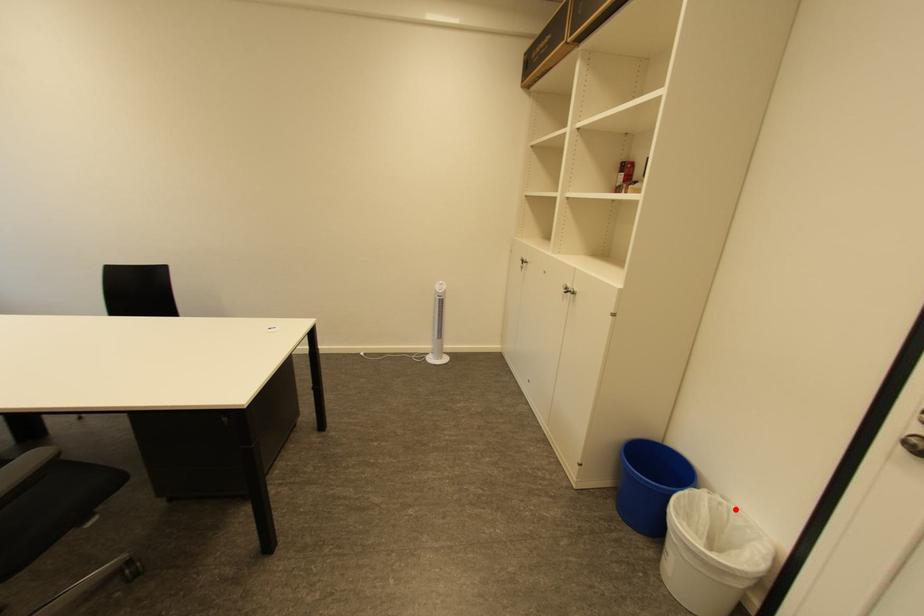
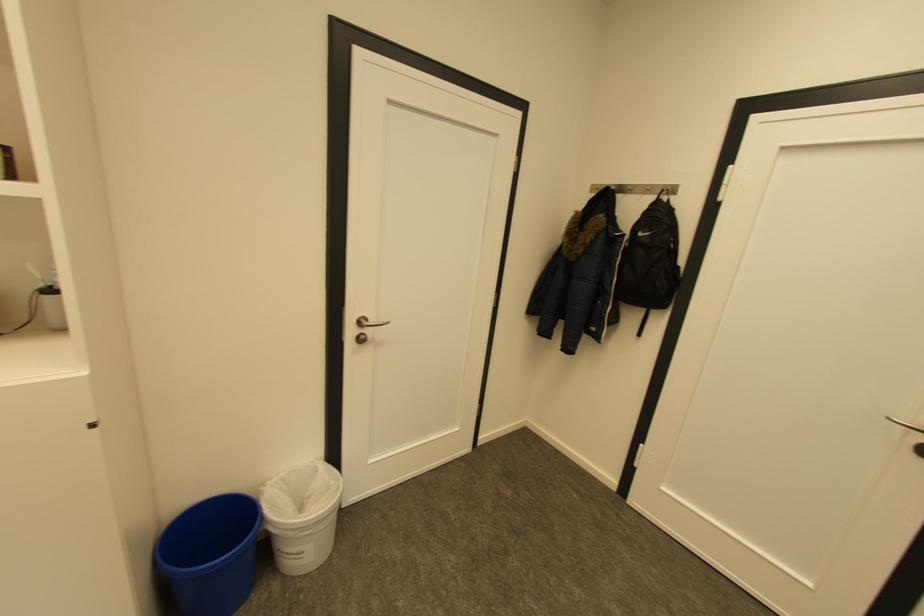
Question: I am providing you with two images of the same scene from different viewpoints. Given a red point in image1, look at the same physical point in image2. Is it:

Choices:
 (A) Closer to the viewpoint
 (B) Farther from the viewpoint

Answer: (B)